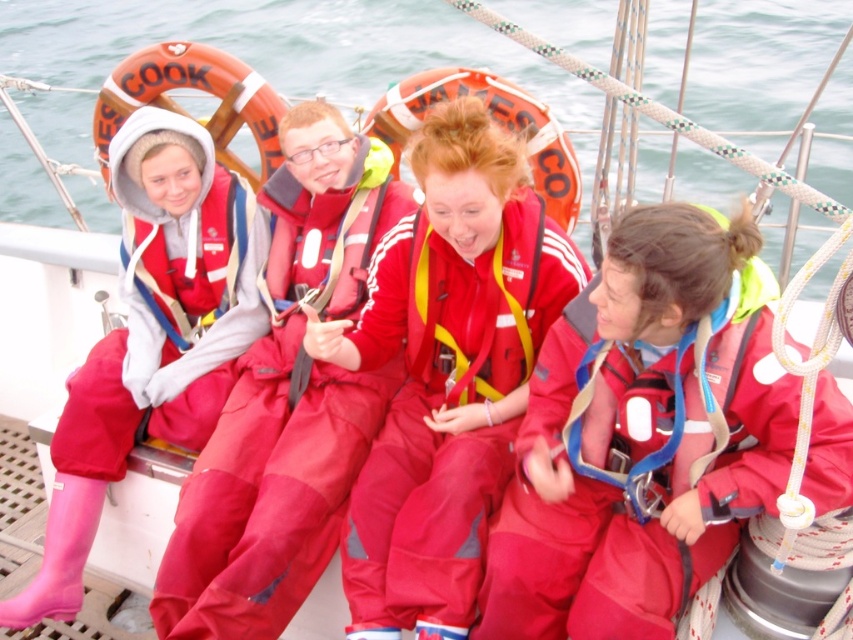
Question: Does matte red jumpsuit at center appear on the right side of pink rubber boots at left?

Choices:
 (A) no
 (B) yes

Answer: (B)

Question: Which object appears farthest from the camera in this image?

Choices:
 (A) matte red life jacket at center
 (B) white fleece life jacket at left
 (C) shiny red life jacket at center
 (D) transparent water at center

Answer: (B)

Question: Is matte red jumpsuit at right to the left of matte red jumpsuit at left from the viewer's perspective?

Choices:
 (A) yes
 (B) no

Answer: (B)

Question: In this image, where is transparent water at center located relative to matte red jumpsuit at center?

Choices:
 (A) below
 (B) above

Answer: (B)

Question: Based on their relative distances, which object is nearer to the white fleece life jacket at left?

Choices:
 (A) matte red jumpsuit at center
 (B) matte red life jacket at center
 (C) pink rubber boots at left

Answer: (C)

Question: Which point appears farthest from the camera in this image?

Choices:
 (A) (628, 390)
 (B) (224, 300)

Answer: (B)